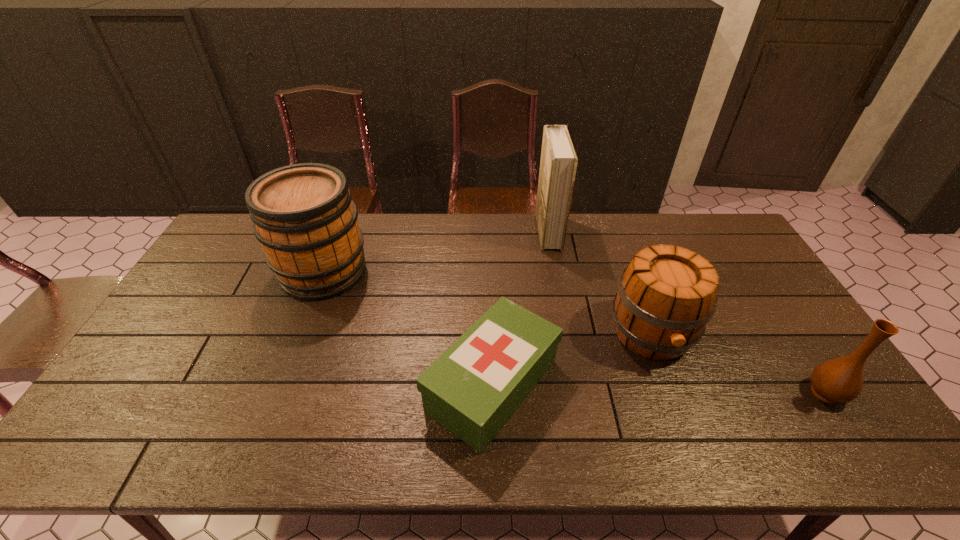
The image size is (960, 540). I want to click on unoccupied position between the second object from left to right and the right cider, so [x=572, y=360].

Locate an element on the screen. The image size is (960, 540). object that is the third closest to the leftmost object is located at coordinates (666, 295).

Image resolution: width=960 pixels, height=540 pixels. I want to click on object that is the third closest to the vase, so click(558, 164).

I want to click on free point that satisfies the following two spatial constraints: 1. on the cover of the phonebook; 2. on the right side of the rightmost object, so click(578, 393).

Locate an element on the screen. vacant point that satisfies the following two spatial constraints: 1. on the front side of the vase; 2. on the right side of the first-aid kit is located at coordinates (492, 393).

In order to click on vacant area that satisfies the following two spatial constraints: 1. on the side of the shorter cider where the spigot is located; 2. on the right side of the vase in this screenshot , I will do `click(673, 393)`.

I want to click on vacant space that satisfies the following two spatial constraints: 1. on the front side of the left cider; 2. on the left side of the rightmost object, so click(277, 393).